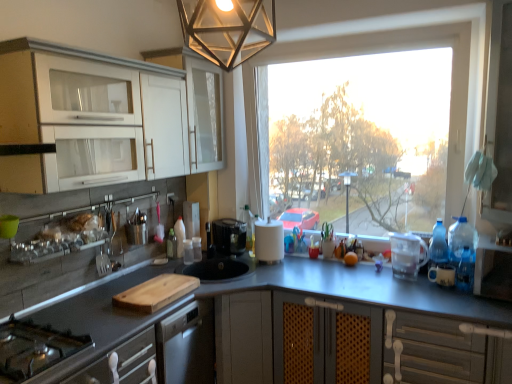
Identify the location of unoccupied area in front of transparent plastic container at right, which is the 3th appliance in right-to-left order. (407, 289).